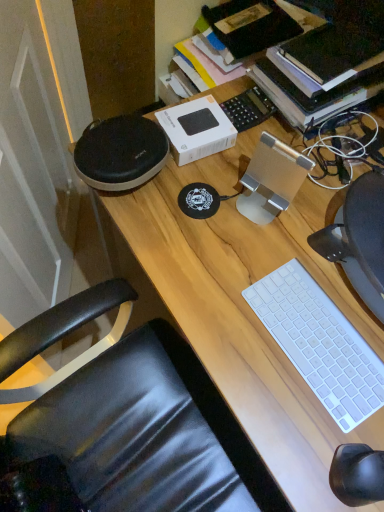
Locate an element on the screen. This screenshot has width=384, height=512. vacant space in white plastic keyboard at lower right (from a real-world perspective) is located at coordinates (316, 345).